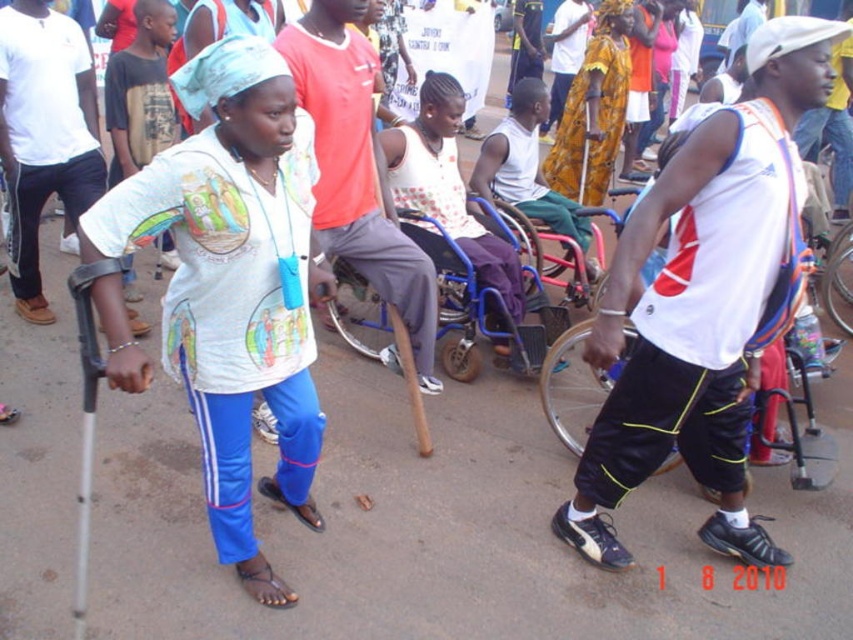
You are a photographer standing at the camera position. You want to take a closeup photo of the point at coordinates point [322,67] and point [498,195]. Which point should you focus on first to ensure it is in sharp focus?

Point [322,67] is closer to the camera than point [498,195], so you should focus on point [322,67] first to ensure it is in sharp focus.